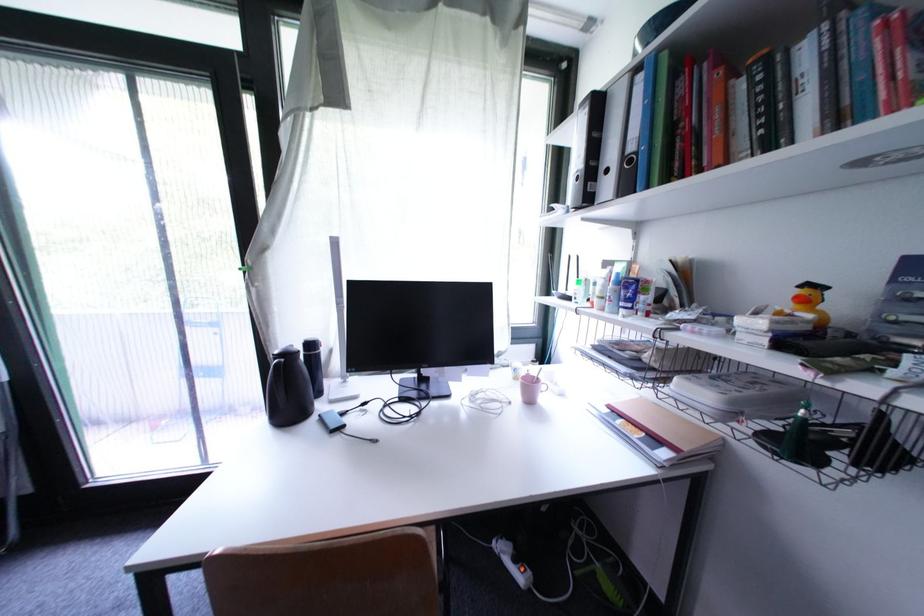
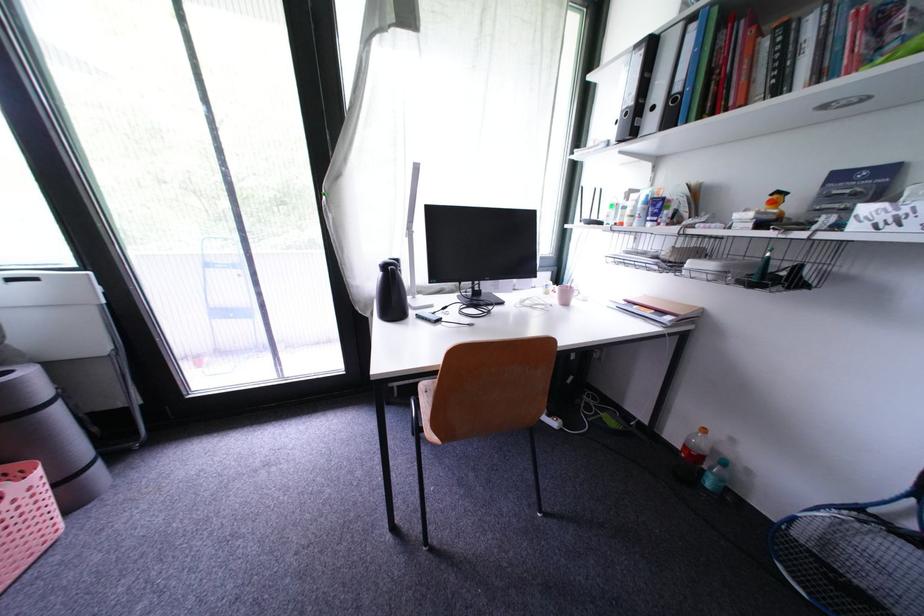
Locate, in the second image, the point that corresponds to point (594, 111) in the first image.

(650, 54)